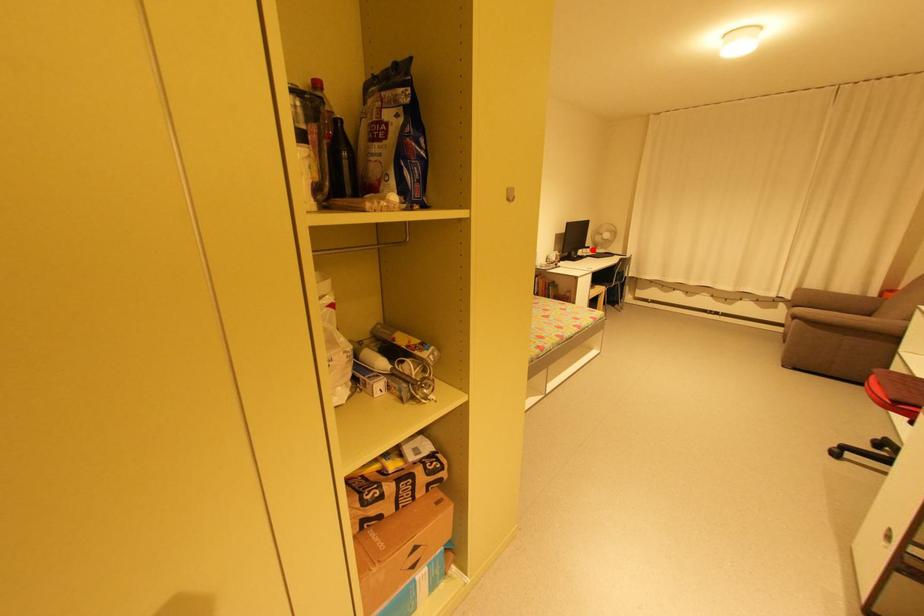
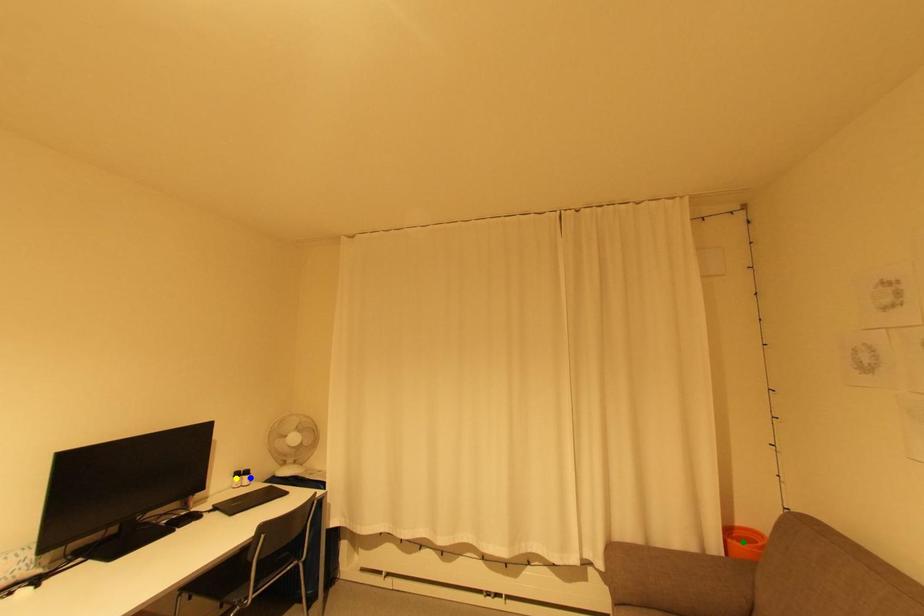
Question: I am providing you with two images of the same scene from different viewpoints. A red point is marked on the first image. You are given multiple points on the second image. Which spot in image 2 lines up with the point in image 1?

Choices:
 (A) yellow point
 (B) green point
 (C) blue point

Answer: (C)